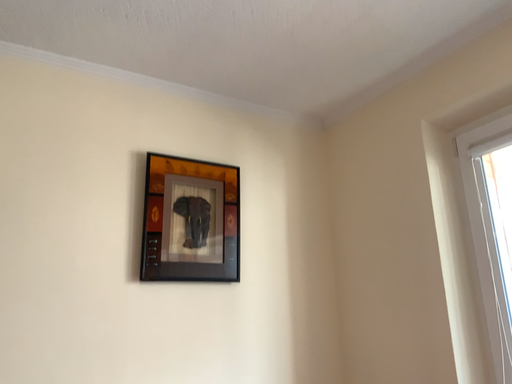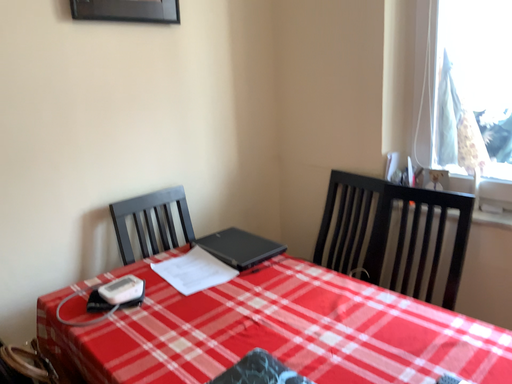
Question: How did the camera likely rotate when shooting the video?

Choices:
 (A) rotated downward
 (B) rotated upward

Answer: (A)